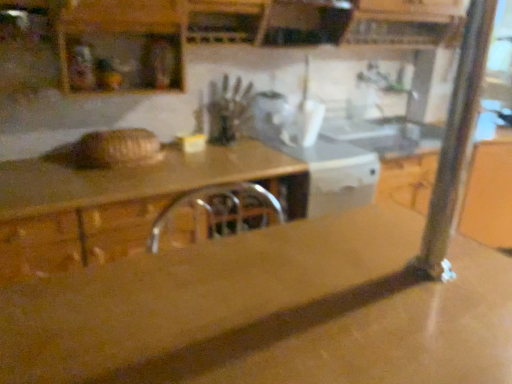
Question: In the image, is white glossy microwave at center on the left side or the right side of brown polished wood countertop at center?

Choices:
 (A) left
 (B) right

Answer: (B)

Question: From their relative heights in the image, would you say white glossy microwave at center is taller or shorter than brown polished wood countertop at center?

Choices:
 (A) short
 (B) tall

Answer: (A)

Question: Is white glossy microwave at center in front of or behind brown polished wood countertop at center in the image?

Choices:
 (A) front
 (B) behind

Answer: (B)

Question: In the image, is brown polished wood countertop at center on the left side or the right side of white glossy microwave at center?

Choices:
 (A) left
 (B) right

Answer: (A)

Question: From the image's perspective, relative to white glossy microwave at center, is brown polished wood countertop at center above or below?

Choices:
 (A) below
 (B) above

Answer: (A)

Question: Is brown polished wood countertop at center inside the boundaries of white glossy microwave at center, or outside?

Choices:
 (A) inside
 (B) outside

Answer: (B)

Question: Is brown polished wood countertop at center in front of or behind white glossy microwave at center in the image?

Choices:
 (A) behind
 (B) front

Answer: (B)